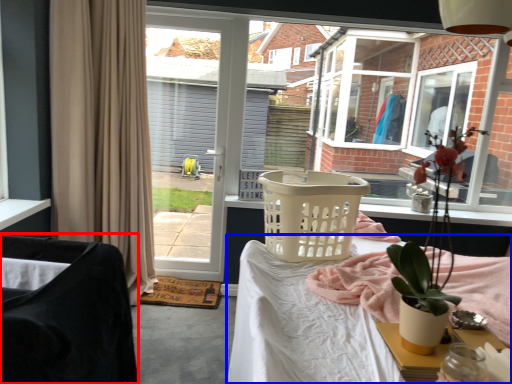
Question: Which point is further to the camera, chair (highlighted by a red box) or desk (highlighted by a blue box)?

Choices:
 (A) chair
 (B) desk

Answer: (B)